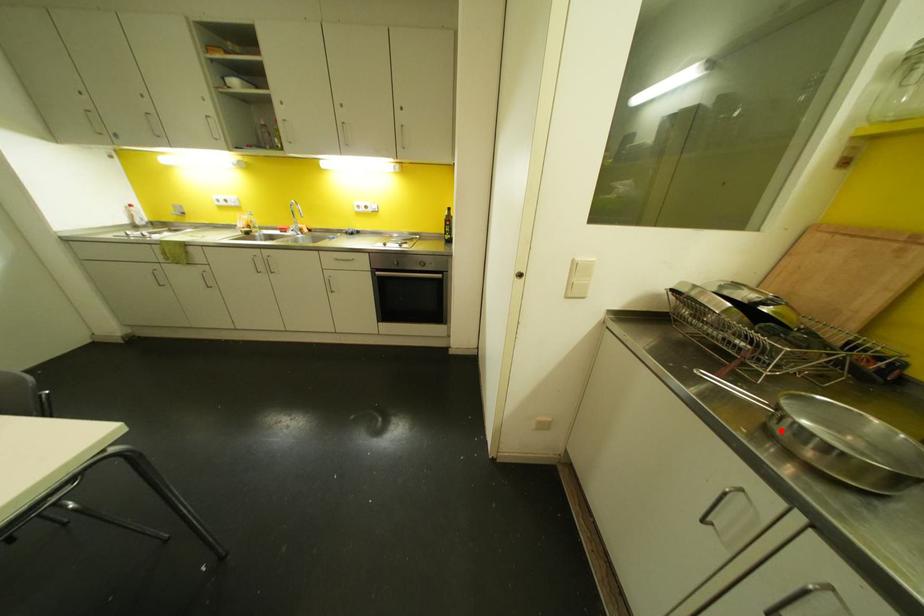
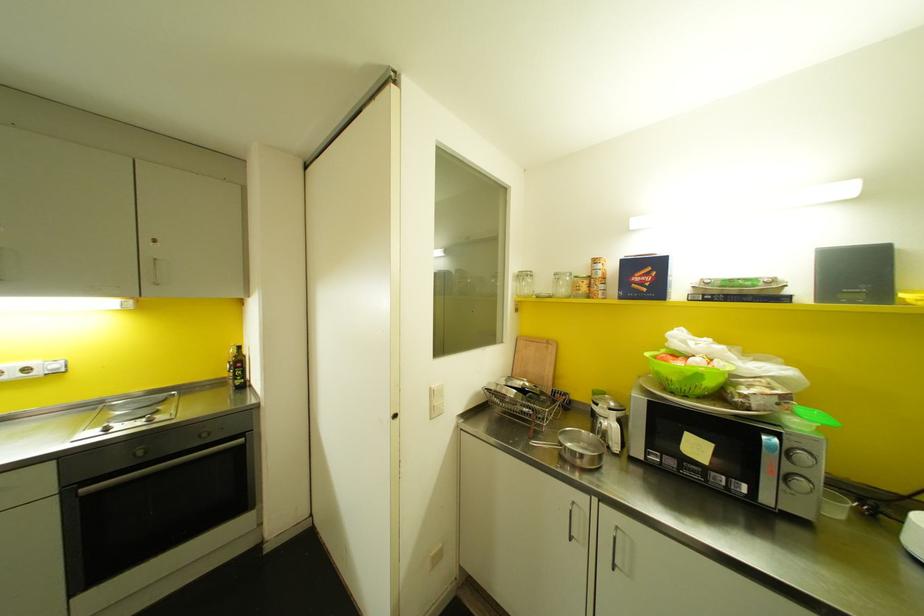
In the second image, find the point that corresponds to the highlighted location in the first image.

(566, 456)